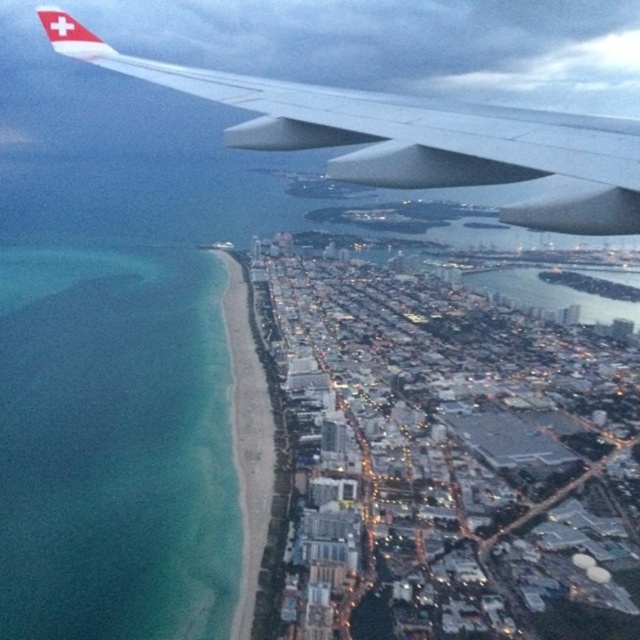
You are a passenger on the Swiss International Air Lines flight and see two points through the airplane window. The first point is at coordinates point (129,340) and the second is at point (250,595). Which point is nearer to you?

Point (129,340) is closer to the viewer than point (250,595).